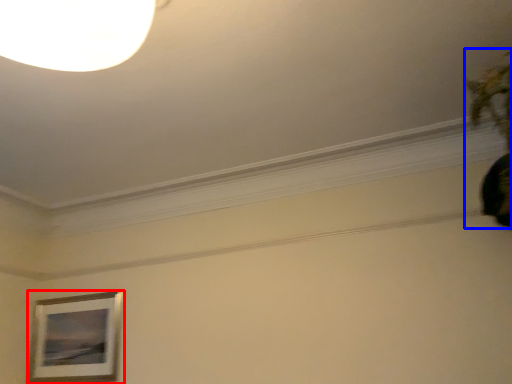
Question: Which of the following is the closest to the observer, picture frame (highlighted by a red box) or plant (highlighted by a blue box)?

Choices:
 (A) picture frame
 (B) plant

Answer: (B)